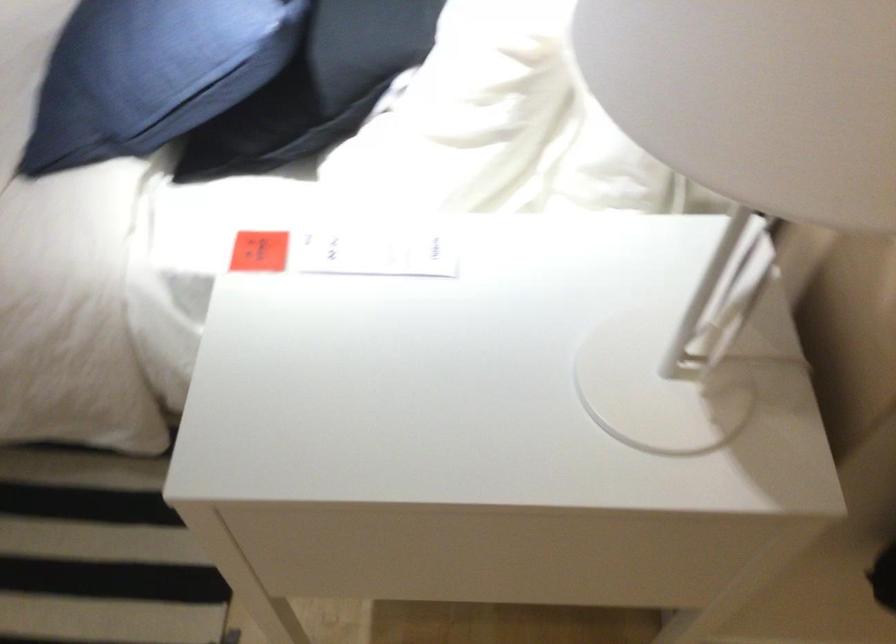
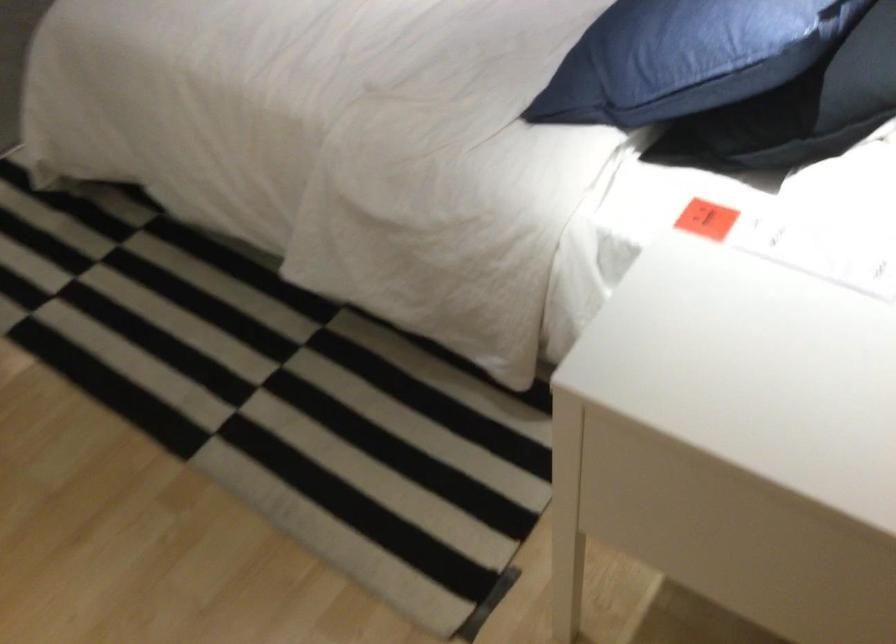
Find the pixel in the second image that matches point (259, 252) in the first image.

(707, 219)